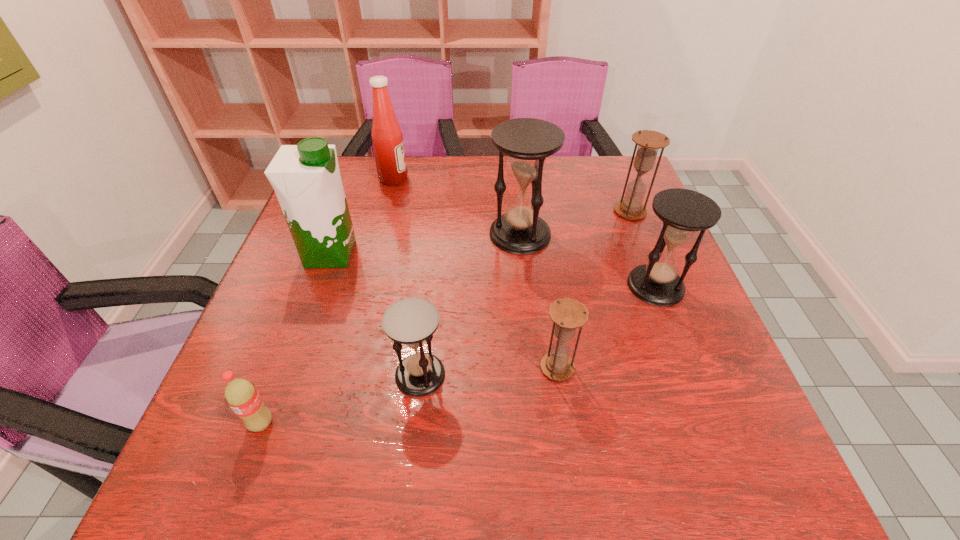
Where is `vacant space located on the left of the nearer brown hourglass`? vacant space located on the left of the nearer brown hourglass is located at coordinates (386, 367).

Where is `free location located on the right of the fourth object from left to right`? This screenshot has height=540, width=960. free location located on the right of the fourth object from left to right is located at coordinates (628, 375).

At what (x,y) coordinates should I click in order to perform the action: click on blank space located on the back of the nearest object. Please return your answer as a coordinate pair (x, y). Looking at the image, I should click on (309, 294).

You are a GUI agent. You are given a task and a screenshot of the screen. Output one action in this format:
    pyautogui.click(x=<x>, y=<y>)
    Task: Click on the condiment that is positioned at the far edge
    This screenshot has height=540, width=960.
    Given the screenshot: What is the action you would take?
    pyautogui.click(x=387, y=138)

This screenshot has width=960, height=540. I want to click on hourglass that is at the far edge, so click(649, 142).

The width and height of the screenshot is (960, 540). Identify the location of soya milk at the left edge. (306, 178).

Where is `soda positioned at the left edge`? The image size is (960, 540). soda positioned at the left edge is located at coordinates (241, 395).

Locate an element on the screen. The image size is (960, 540). object at the far right corner is located at coordinates (649, 142).

Where is `blank space at the far edge`? blank space at the far edge is located at coordinates (435, 159).

In the image, there is a desktop. Identify the location of vacant space at the near edge. (299, 455).